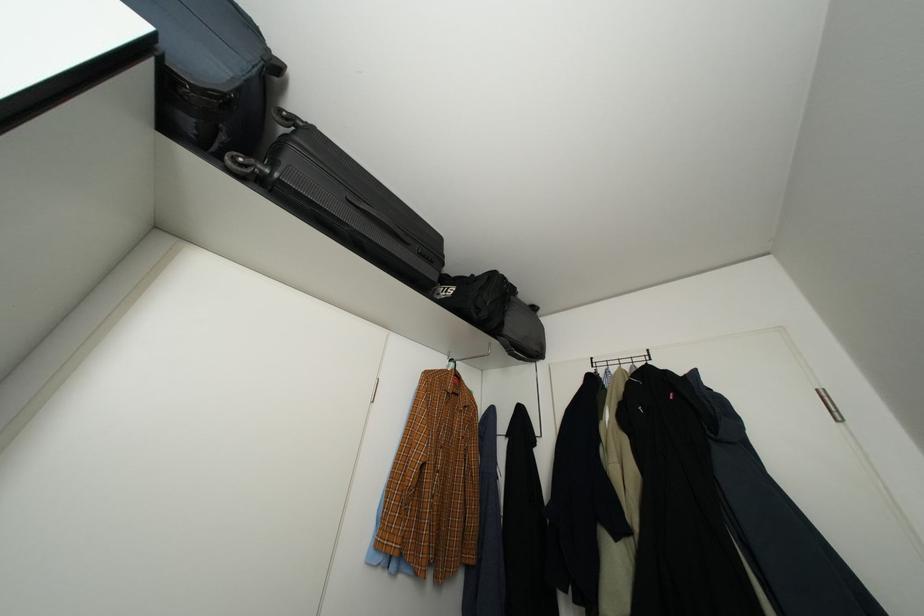
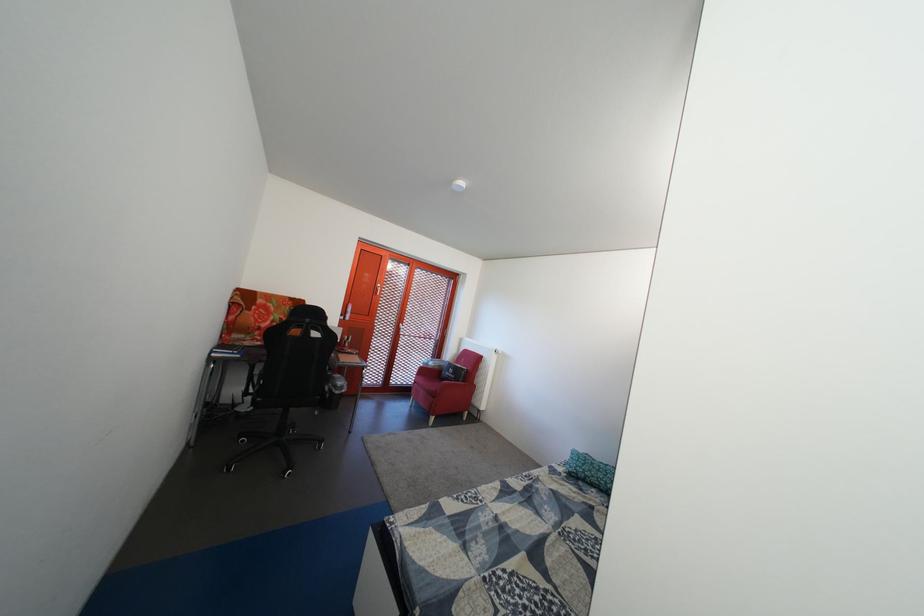
Question: How did the camera likely rotate?

Choices:
 (A) Left
 (B) Right
 (C) Up
 (D) Down

Answer: (A)